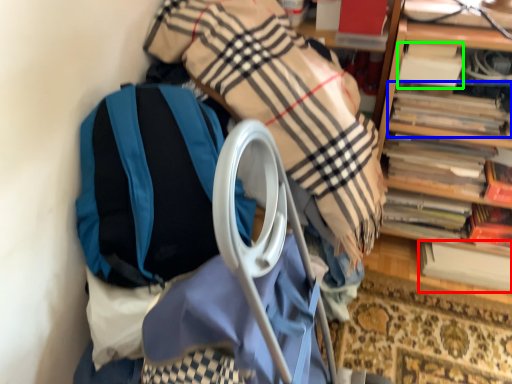
Question: Based on their relative distances, which object is nearer to book (highlighted by a red box)? Choose from book (highlighted by a blue box) and book (highlighted by a green box).

Choices:
 (A) book
 (B) book

Answer: (A)